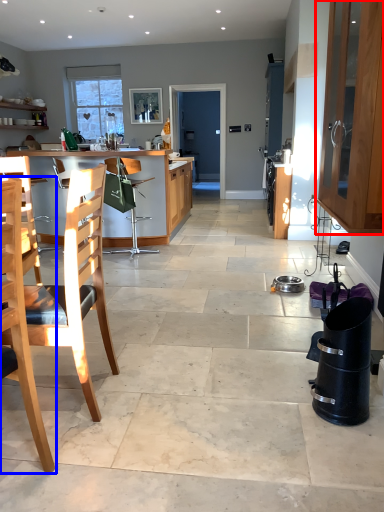
Question: Which of the following is the farthest to the observer, cabinetry (highlighted by a red box) or chair (highlighted by a blue box)?

Choices:
 (A) cabinetry
 (B) chair

Answer: (A)